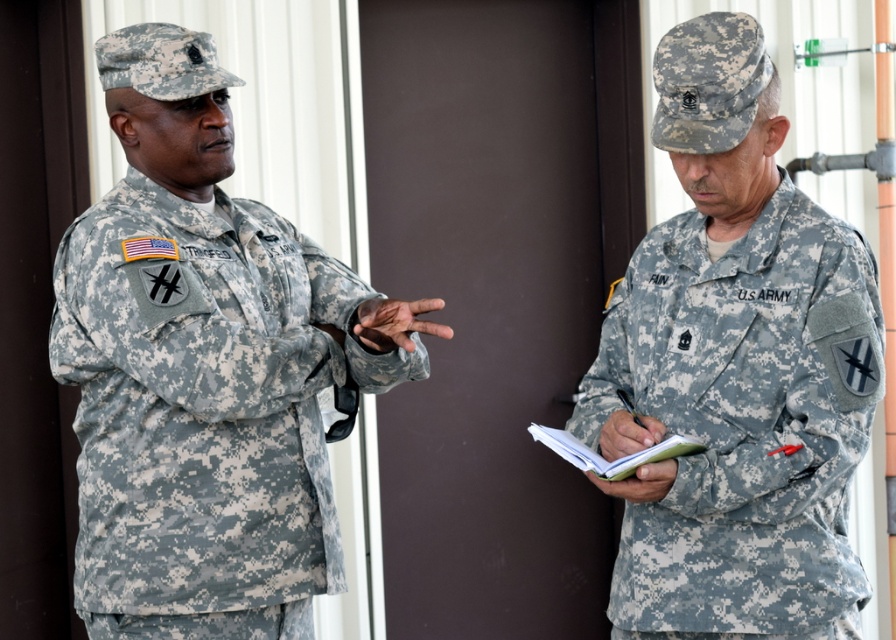
Who is shorter, camouflage fabric uniform at left or camouflage fabric us army uniform at right?

With less height is camouflage fabric us army uniform at right.

Who is lower down, camouflage fabric uniform at left or camouflage fabric us army uniform at right?

camouflage fabric uniform at left

Where is `camouflage fabric uniform at left`? This screenshot has width=896, height=640. camouflage fabric uniform at left is located at coordinates (204, 401).

I want to click on camouflage fabric uniform at left, so tap(204, 401).